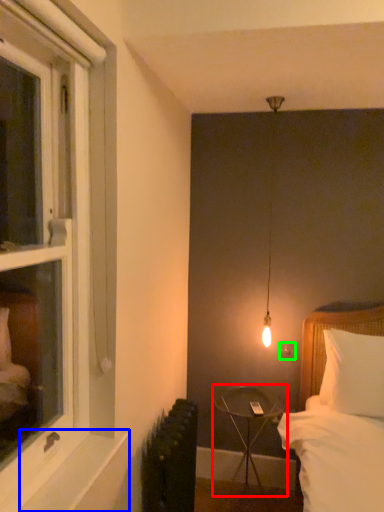
Question: Estimate the real-world distances between objects in this image. Which object is farther from table (highlighted by a red box), window sill (highlighted by a blue box) or electric outlet (highlighted by a green box)?

Choices:
 (A) window sill
 (B) electric outlet

Answer: (A)